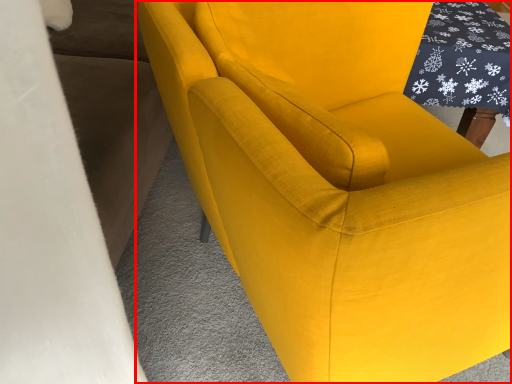
Question: Considering the relative positions of chair (annotated by the red box) and table in the image provided, where is chair (annotated by the red box) located with respect to the staircase?

Choices:
 (A) right
 (B) left

Answer: (B)